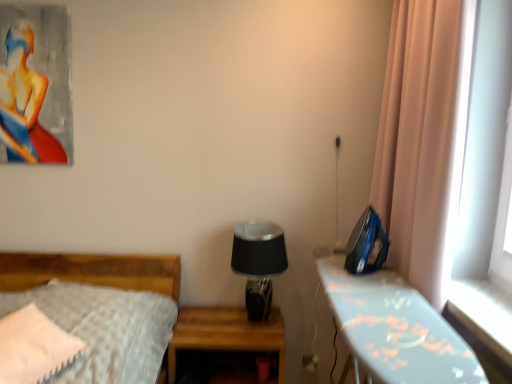
Question: Should I look upward or downward to see matte acrylic painting of a woman at upper left?

Choices:
 (A) up
 (B) down

Answer: (A)

Question: Is blue plastic iron at right, arranged as the 2th nightstand when viewed from the left, to the right of black glass table lamp at center from the viewer's perspective?

Choices:
 (A) yes
 (B) no

Answer: (A)

Question: Is blue plastic iron at right, arranged as the 2th nightstand when viewed from the left, taller than black glass table lamp at center?

Choices:
 (A) yes
 (B) no

Answer: (A)

Question: Does blue plastic iron at right, which is the first nightstand in right-to-left order, have a larger size compared to black glass table lamp at center?

Choices:
 (A) no
 (B) yes

Answer: (B)

Question: From a real-world perspective, is blue plastic iron at right, arranged as the 2th nightstand when viewed from the left, beneath black glass table lamp at center?

Choices:
 (A) no
 (B) yes

Answer: (B)

Question: Is blue plastic iron at right, arranged as the 2th nightstand when viewed from the left, positioned before black glass table lamp at center?

Choices:
 (A) no
 (B) yes

Answer: (B)

Question: From the image's perspective, is blue plastic iron at right, arranged as the 2th nightstand when viewed from the left, beneath black glass table lamp at center?

Choices:
 (A) no
 (B) yes

Answer: (B)

Question: Is black glass table lamp at center inside white fluffy pillow at lower left?

Choices:
 (A) no
 (B) yes

Answer: (A)

Question: Does white fluffy pillow at lower left have a greater width compared to black glass table lamp at center?

Choices:
 (A) no
 (B) yes

Answer: (B)

Question: Is white fluffy pillow at lower left facing away from black glass table lamp at center?

Choices:
 (A) yes
 (B) no

Answer: (A)

Question: Is white fluffy pillow at lower left positioned far away from black glass table lamp at center?

Choices:
 (A) no
 (B) yes

Answer: (A)

Question: Is white fluffy pillow at lower left smaller than black glass table lamp at center?

Choices:
 (A) no
 (B) yes

Answer: (B)

Question: Are white fluffy pillow at lower left and black glass table lamp at center making contact?

Choices:
 (A) yes
 (B) no

Answer: (B)

Question: From the image's perspective, would you say matte acrylic painting of a woman at upper left is positioned over blue plastic iron at right, arranged as the 2th nightstand when viewed from the left?

Choices:
 (A) no
 (B) yes

Answer: (B)